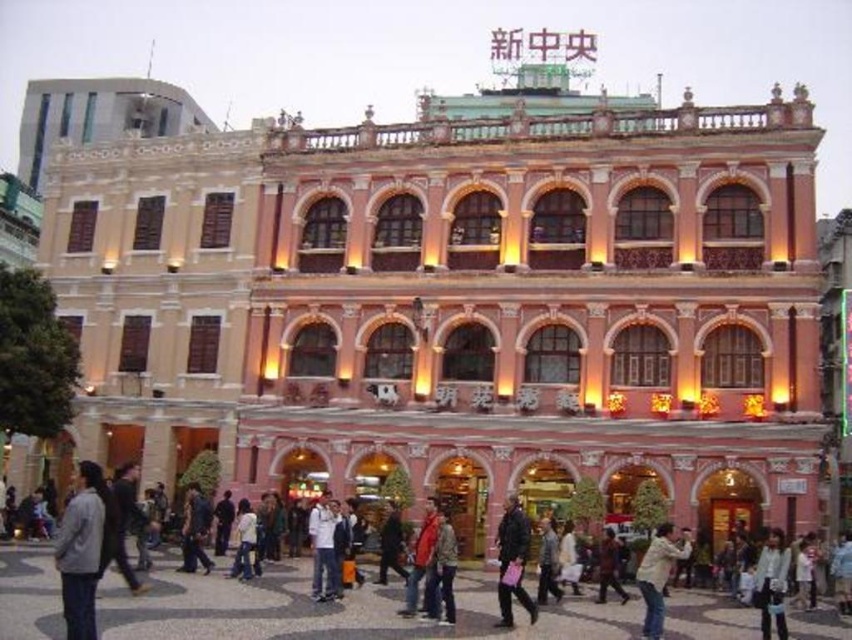
You are standing in front of the pink building and want to take a photo. There are two points on the building that you need to focus on. The first is point at point (68, 563), and the second is point at point (326, 497). Which point should you focus on first to ensure it appears larger in your photo?

Point at point (68, 563) should be focused on first because it is closer to the viewer than point at point (326, 497), making it appear larger in the photo.

You are standing in front of the large pink building with white trimmings. You see a point at coordinates [332,611]. What object is located at that point?

The point at coordinates [332,611] corresponds to the light gray jacket at center.

You are a fashion designer attending an event at the ornate pink building. You notice two jackets in the crowd. Which jacket is closer to you, the light gray jacket at center or the white matte jacket at lower right?

The light gray jacket at center is closer to you because it is in front of the white matte jacket at lower right.